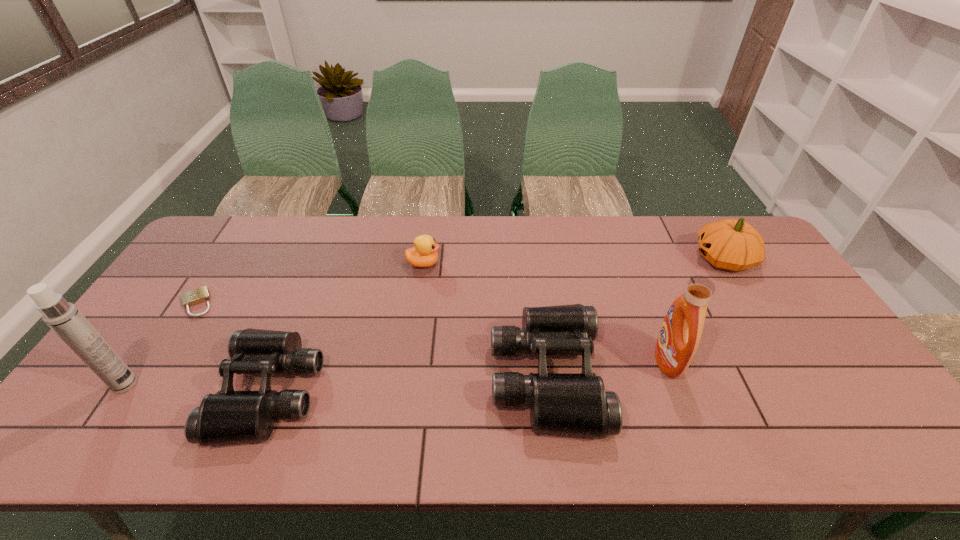
Where is `vacant space that's between the fourth object from right to left and the aerosol can`? This screenshot has width=960, height=540. vacant space that's between the fourth object from right to left and the aerosol can is located at coordinates (275, 324).

Find the location of `vacant space that's between the left binoculars and the tallest object`. vacant space that's between the left binoculars and the tallest object is located at coordinates (198, 388).

Locate an element on the screen. The image size is (960, 540). vacant region between the padlock and the second object from right to left is located at coordinates (432, 332).

At what (x,y) coordinates should I click in order to perform the action: click on the sixth closest object relative to the third object from right to left. Please return your answer as a coordinate pair (x, y). Looking at the image, I should click on (63, 317).

At what (x,y) coordinates should I click in order to perform the action: click on object that ranks as the second closest to the duckling. Please return your answer as a coordinate pair (x, y). Looking at the image, I should click on click(x=228, y=416).